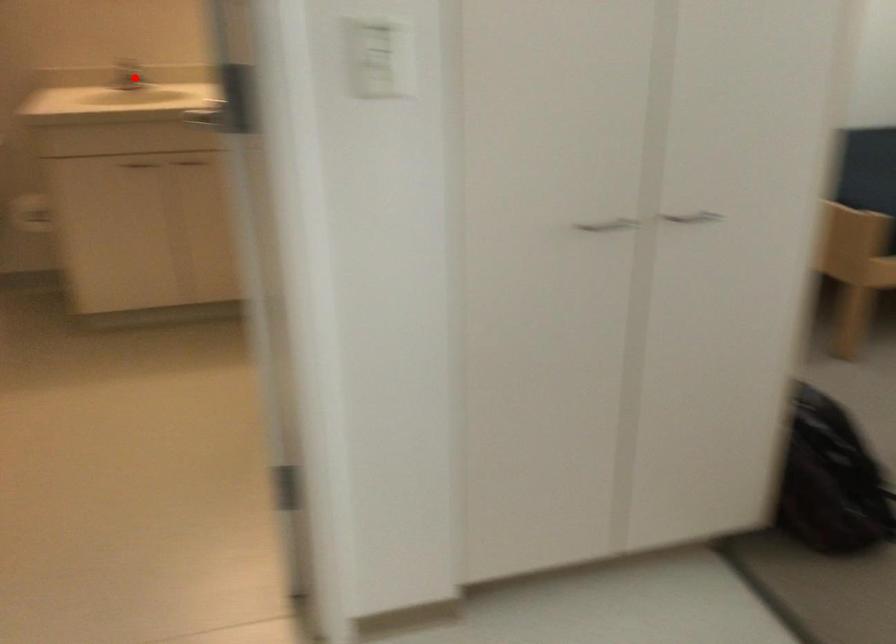
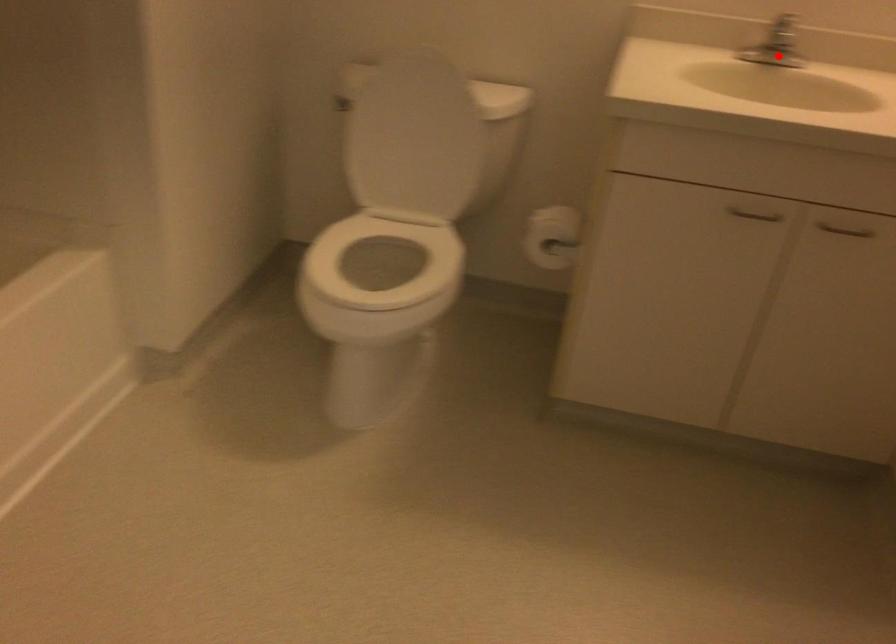
In the scene shown: I am providing you with two images of the same scene from different viewpoints. A red point is marked on the first image and another point is marked on the second image. Is the red point in image1 aligned with the point shown in image2?

Yes